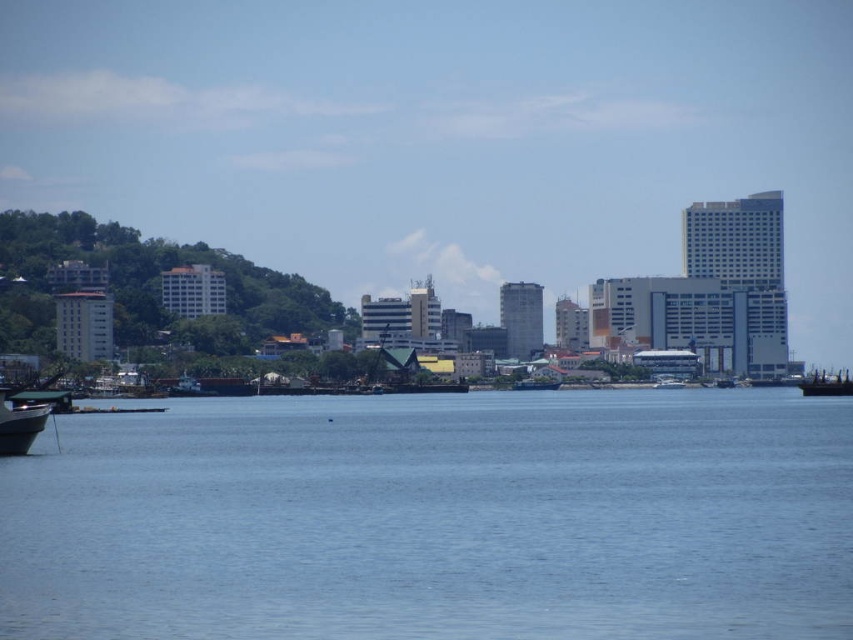
You are a photographer standing on the dock and want to capture both the blue water at center and the white glossy boat at center in a single shot. Based on their positions, which object will appear larger in the photo?

The blue water at center will appear larger in the photo because it is much taller than the white glossy boat at center.

Based on the photo, you are standing at the waterfront and want to take a photo of the blue water at center and the metallic gray boat at lower left. Which object should you focus on first to ensure it appears sharp in your photo?

The blue water at center is closer to the viewer than the metallic gray boat at lower left, so you should focus on the blue water at center first to ensure it appears sharp in your photo.

You are a photographer planning to capture the waterfront cityscape. You want to ensure that the blue water at center and the white glossy boat at center are both visible in your shot. Given their sizes, which object should you focus on to frame the scene appropriately?

The blue water at center is larger in size than the white glossy boat at center, so you should focus on framing the blue water at center as it occupies more space in the scene.